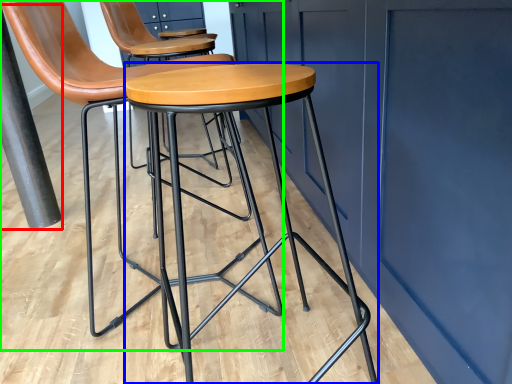
Question: Which object is the farthest from pole (highlighted by a red box)? Choose among these: stool (highlighted by a blue box) or chair (highlighted by a green box).

Choices:
 (A) stool
 (B) chair

Answer: (A)